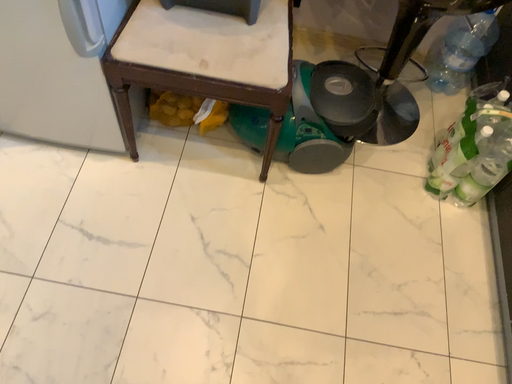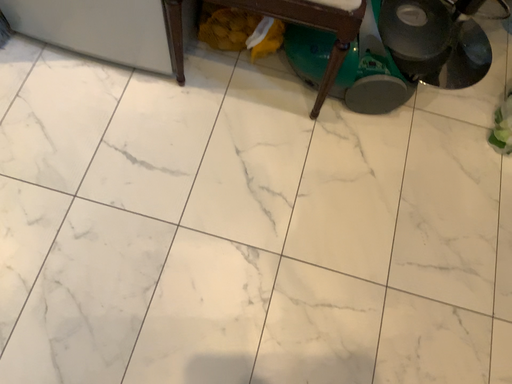
Question: How did the camera likely rotate when shooting the video?

Choices:
 (A) rotated downward
 (B) rotated upward

Answer: (A)